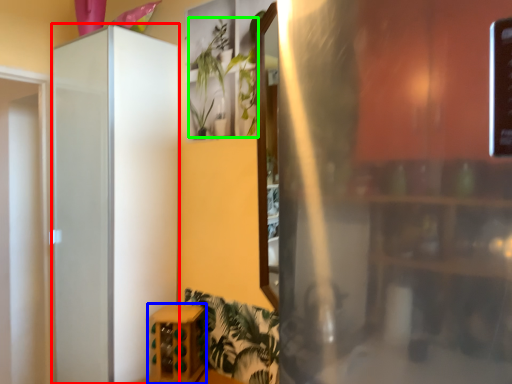
Question: Which is nearer to the screen door (highlighted by a red box)? furniture (highlighted by a blue box) or plant (highlighted by a green box).

Choices:
 (A) furniture
 (B) plant

Answer: (A)